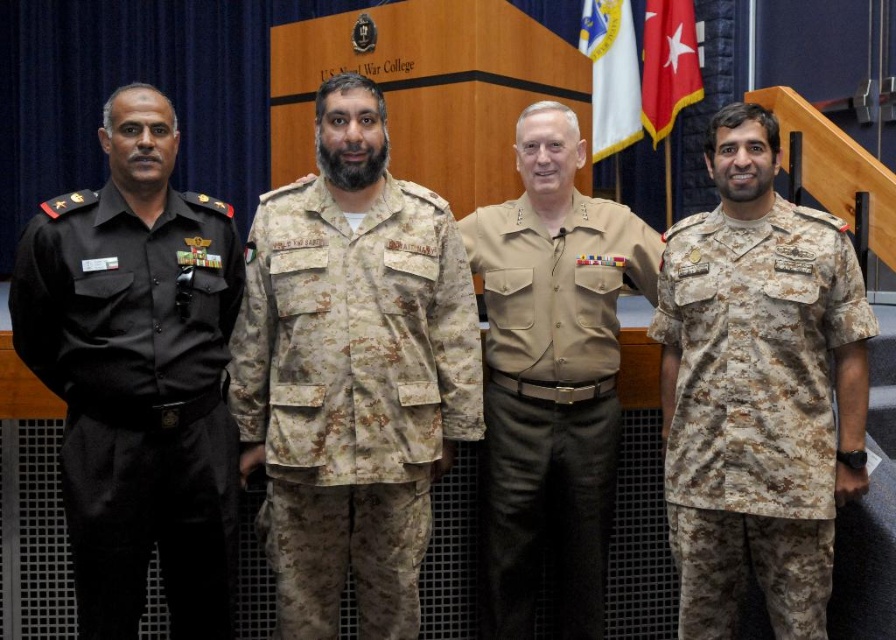
Is black uniform at left to the right of tan uniform at center from the viewer's perspective?

Incorrect, black uniform at left is not on the right side of tan uniform at center.

Who is higher up, black uniform at left or tan uniform at center?

black uniform at left is above.

Where is `black uniform at left`? This screenshot has width=896, height=640. black uniform at left is located at coordinates tap(138, 376).

Does tan uniform at center appear on the left side of white fabric flag at upper center?

Correct, you'll find tan uniform at center to the left of white fabric flag at upper center.

At what (x,y) coordinates should I click in order to perform the action: click on tan uniform at center. Please return your answer as a coordinate pair (x, y). The image size is (896, 640). Looking at the image, I should click on (550, 378).

Is point (507, 577) positioned in front of point (622, 20)?

Yes, point (507, 577) is closer to viewer.

At what (x,y) coordinates should I click in order to perform the action: click on tan uniform at center. Please return your answer as a coordinate pair (x, y). Image resolution: width=896 pixels, height=640 pixels. Looking at the image, I should click on (550, 378).

Which is above, tan uniform at center or red fabric flag at upper right?

Positioned higher is red fabric flag at upper right.

You are a GUI agent. You are given a task and a screenshot of the screen. Output one action in this format:
    pyautogui.click(x=<x>, y=<y>)
    Task: Click on the tan uniform at center
    The image size is (896, 640).
    Given the screenshot: What is the action you would take?
    pyautogui.click(x=550, y=378)

The height and width of the screenshot is (640, 896). I want to click on tan uniform at center, so click(x=550, y=378).